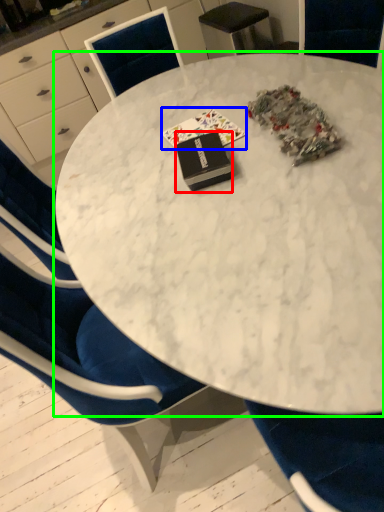
Question: Which object is positioned closest to book (highlighted by a red box)? Select from book (highlighted by a blue box) and table (highlighted by a green box).

Choices:
 (A) book
 (B) table

Answer: (A)